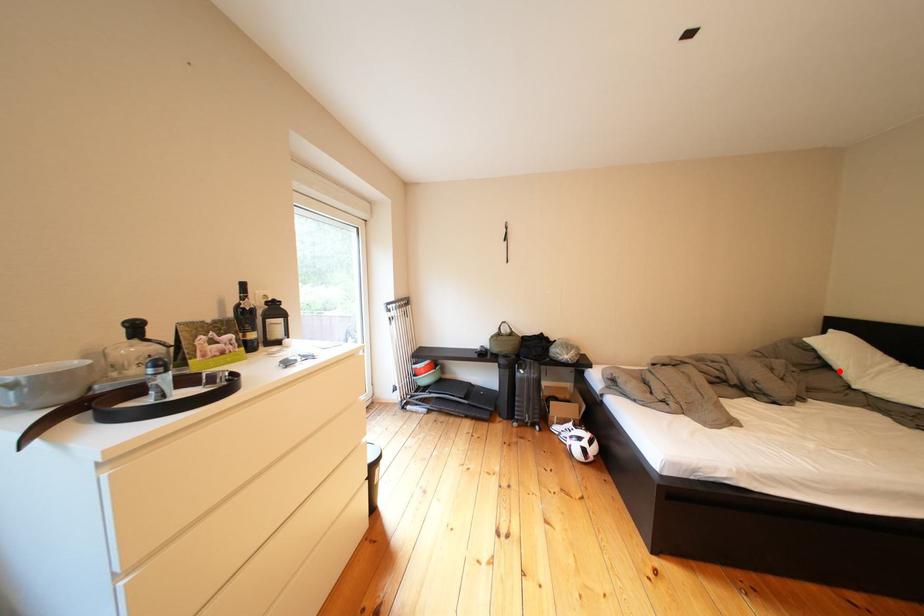
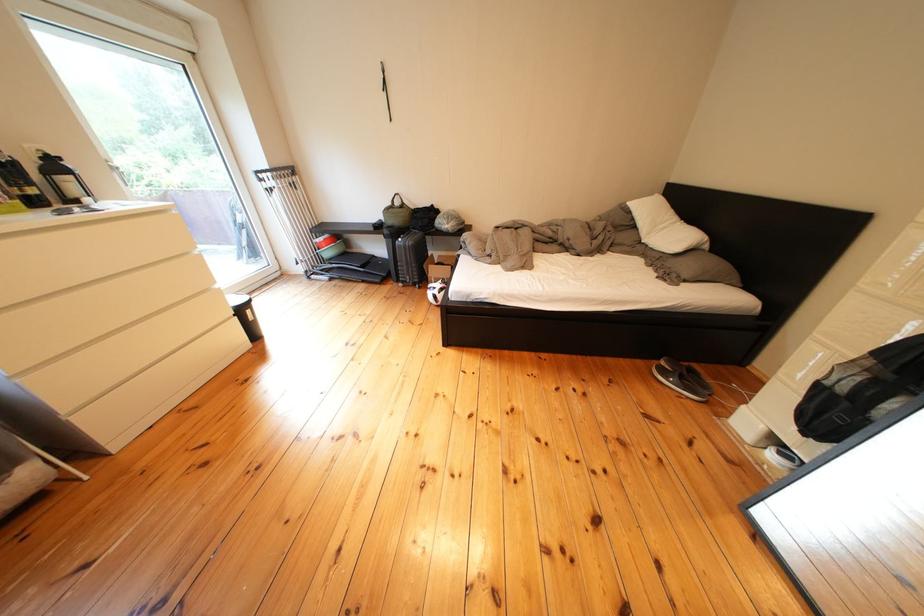
Where in the second image is the point corresponding to the highlighted location from the first image?

(649, 230)